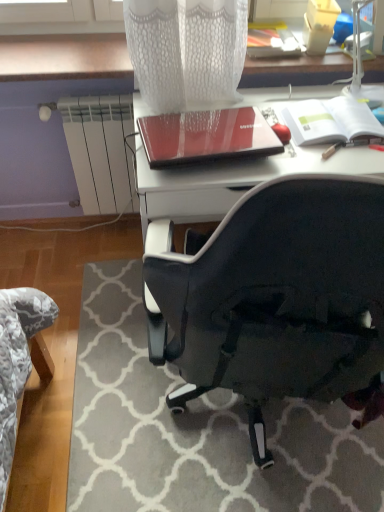
Measure the distance between white mesh table lamp at upper right and camera.

white mesh table lamp at upper right and camera are 1.47 meters apart from each other.

The width and height of the screenshot is (384, 512). Identify the location of black fabric chair at lower right. (277, 300).

Image resolution: width=384 pixels, height=512 pixels. What are the coordinates of `white mesh table lamp at upper right` in the screenshot? It's located at 361,62.

Is red glossy notebook at upper center, marked as the 1th notebook in a left-to-right arrangement, not close to black fabric chair at lower right?

Actually, red glossy notebook at upper center, marked as the 1th notebook in a left-to-right arrangement, and black fabric chair at lower right are a little close together.

Is red glossy notebook at upper center, which is the 2th notebook from right to left, looking in the opposite direction of black fabric chair at lower right?

No, red glossy notebook at upper center, which is the 2th notebook from right to left, is not facing the opposite direction of black fabric chair at lower right.

From a real-world perspective, is red glossy notebook at upper center, which is the 2th notebook from right to left, over black fabric chair at lower right?

Yes, from a real-world perspective, red glossy notebook at upper center, which is the 2th notebook from right to left, is on top of black fabric chair at lower right.

Considering the positions of objects red glossy notebook at upper center, marked as the 1th notebook in a left-to-right arrangement, and black fabric chair at lower right in the image provided, who is more to the right, red glossy notebook at upper center, marked as the 1th notebook in a left-to-right arrangement, or black fabric chair at lower right?

black fabric chair at lower right.

Which of these two, white matte notebook at upper right, the 1th notebook from the right, or white mesh table lamp at upper right, is wider?

With larger width is white matte notebook at upper right, the 1th notebook from the right.

Considering the relative sizes of white matte notebook at upper right, the 2th notebook in the left-to-right sequence, and white mesh table lamp at upper right in the image provided, is white matte notebook at upper right, the 2th notebook in the left-to-right sequence, bigger than white mesh table lamp at upper right?

No, white matte notebook at upper right, the 2th notebook in the left-to-right sequence, is not bigger than white mesh table lamp at upper right.

Could you tell me if white matte notebook at upper right, the 1th notebook from the right, is turned towards white mesh table lamp at upper right?

No, white matte notebook at upper right, the 1th notebook from the right, is not turned towards white mesh table lamp at upper right.

From the image's perspective, is white matte notebook at upper right, the 1th notebook from the right, located above or below white mesh table lamp at upper right?

Clearly, from the image's perspective, white matte notebook at upper right, the 1th notebook from the right, is below white mesh table lamp at upper right.

Which object is thinner, white mesh table lamp at upper right or white matte notebook at upper right, the 1th notebook from the right?

white mesh table lamp at upper right is thinner.

Can you see white mesh table lamp at upper right touching white matte notebook at upper right, the 2th notebook in the left-to-right sequence?

No, white mesh table lamp at upper right is not with white matte notebook at upper right, the 2th notebook in the left-to-right sequence.

How distant is white mesh table lamp at upper right from white matte notebook at upper right, the 2th notebook in the left-to-right sequence?

The distance of white mesh table lamp at upper right from white matte notebook at upper right, the 2th notebook in the left-to-right sequence, is 7.59 inches.

Between red glossy notebook at upper center, marked as the 1th notebook in a left-to-right arrangement, and white matte notebook at upper right, the 2th notebook in the left-to-right sequence, which one appears on the left side from the viewer's perspective?

red glossy notebook at upper center, marked as the 1th notebook in a left-to-right arrangement.

Measure the distance from red glossy notebook at upper center, marked as the 1th notebook in a left-to-right arrangement, to white matte notebook at upper right, the 2th notebook in the left-to-right sequence.

red glossy notebook at upper center, marked as the 1th notebook in a left-to-right arrangement, and white matte notebook at upper right, the 2th notebook in the left-to-right sequence, are 25.52 centimeters apart.

Which is closer, (242, 135) or (306, 123)?

Positioned in front is point (242, 135).

Between red glossy notebook at upper center, marked as the 1th notebook in a left-to-right arrangement, and white matte notebook at upper right, the 1th notebook from the right, which one has larger size?

With larger size is red glossy notebook at upper center, marked as the 1th notebook in a left-to-right arrangement.

From the image's perspective, is white matte notebook at upper right, the 2th notebook in the left-to-right sequence, above or below red glossy notebook at upper center, marked as the 1th notebook in a left-to-right arrangement?

Clearly, from the image's perspective, white matte notebook at upper right, the 2th notebook in the left-to-right sequence, is above red glossy notebook at upper center, marked as the 1th notebook in a left-to-right arrangement.

From the picture: Does white matte notebook at upper right, the 1th notebook from the right, have a greater width compared to red glossy notebook at upper center, marked as the 1th notebook in a left-to-right arrangement?

Incorrect, the width of white matte notebook at upper right, the 1th notebook from the right, does not surpass that of red glossy notebook at upper center, marked as the 1th notebook in a left-to-right arrangement.

Locate an element on the screen. notebook lying on the right of red glossy notebook at upper center, which is the 2th notebook from right to left is located at coordinates (330, 121).

Are white matte notebook at upper right, the 2th notebook in the left-to-right sequence, and red glossy notebook at upper center, marked as the 1th notebook in a left-to-right arrangement, beside each other?

white matte notebook at upper right, the 2th notebook in the left-to-right sequence, and red glossy notebook at upper center, marked as the 1th notebook in a left-to-right arrangement, are not in contact.

Based on the photo, could you tell me if white matte notebook at upper right, the 2th notebook in the left-to-right sequence, is turned towards black fabric chair at lower right?

No, white matte notebook at upper right, the 2th notebook in the left-to-right sequence, does not turn towards black fabric chair at lower right.

Which of these two, white matte notebook at upper right, the 1th notebook from the right, or black fabric chair at lower right, is wider?

Wider between the two is black fabric chair at lower right.

Can you confirm if white matte notebook at upper right, the 1th notebook from the right, is shorter than black fabric chair at lower right?

In fact, white matte notebook at upper right, the 1th notebook from the right, may be taller than black fabric chair at lower right.

Is white matte notebook at upper right, the 2th notebook in the left-to-right sequence, to the left of black fabric chair at lower right from the viewer's perspective?

No.

Is black fabric chair at lower right with red glossy notebook at upper center, which is the 2th notebook from right to left?

There is a gap between black fabric chair at lower right and red glossy notebook at upper center, which is the 2th notebook from right to left.

Considering the points (372, 274) and (242, 123), which point is behind, point (372, 274) or point (242, 123)?

The point (242, 123) is more distant.

Considering the sizes of black fabric chair at lower right and red glossy notebook at upper center, which is the 2th notebook from right to left, in the image, is black fabric chair at lower right taller or shorter than red glossy notebook at upper center, which is the 2th notebook from right to left,?

black fabric chair at lower right is shorter than red glossy notebook at upper center, which is the 2th notebook from right to left.

The height and width of the screenshot is (512, 384). Identify the location of notebook in front of the black fabric chair at lower right. (206, 136).

Find the location of a particular element. Image resolution: width=384 pixels, height=512 pixels. the 1st notebook counting from the left side of the white mesh table lamp at upper right is located at coordinates (330, 121).

Based on their spatial positions, is white mesh table lamp at upper right or white matte notebook at upper right, the 2th notebook in the left-to-right sequence, closer to red glossy notebook at upper center, marked as the 1th notebook in a left-to-right arrangement?

Among the two, white matte notebook at upper right, the 2th notebook in the left-to-right sequence, is located nearer to red glossy notebook at upper center, marked as the 1th notebook in a left-to-right arrangement.

Estimate the real-world distances between objects in this image. Which object is closer to red glossy notebook at upper center, which is the 2th notebook from right to left, black fabric chair at lower right or white mesh table lamp at upper right?

The object closer to red glossy notebook at upper center, which is the 2th notebook from right to left, is white mesh table lamp at upper right.

Which object lies nearer to the anchor point white matte notebook at upper right, the 2th notebook in the left-to-right sequence, white mesh table lamp at upper right or red glossy notebook at upper center, which is the 2th notebook from right to left?

white mesh table lamp at upper right lies closer to white matte notebook at upper right, the 2th notebook in the left-to-right sequence, than the other object.

Estimate the real-world distances between objects in this image. Which object is closer to white matte notebook at upper right, the 1th notebook from the right, red glossy notebook at upper center, marked as the 1th notebook in a left-to-right arrangement, or black fabric chair at lower right?

red glossy notebook at upper center, marked as the 1th notebook in a left-to-right arrangement.

Which object lies nearer to the anchor point red glossy notebook at upper center, which is the 2th notebook from right to left, white matte notebook at upper right, the 2th notebook in the left-to-right sequence, or black fabric chair at lower right?

white matte notebook at upper right, the 2th notebook in the left-to-right sequence, lies closer to red glossy notebook at upper center, which is the 2th notebook from right to left, than the other object.

When comparing their distances from black fabric chair at lower right, does white mesh table lamp at upper right or red glossy notebook at upper center, marked as the 1th notebook in a left-to-right arrangement, seem further?

white mesh table lamp at upper right.

When comparing their distances from red glossy notebook at upper center, which is the 2th notebook from right to left, does white mesh table lamp at upper right or black fabric chair at lower right seem further?

The object further to red glossy notebook at upper center, which is the 2th notebook from right to left, is black fabric chair at lower right.

When comparing their distances from white mesh table lamp at upper right, does white matte notebook at upper right, the 1th notebook from the right, or red glossy notebook at upper center, marked as the 1th notebook in a left-to-right arrangement, seem closer?

white matte notebook at upper right, the 1th notebook from the right, lies closer to white mesh table lamp at upper right than the other object.

Find the location of a particular element. notebook situated between red glossy notebook at upper center, which is the 2th notebook from right to left, and white mesh table lamp at upper right from left to right is located at coordinates (330, 121).

The height and width of the screenshot is (512, 384). In order to click on notebook between white matte notebook at upper right, the 2th notebook in the left-to-right sequence, and black fabric chair at lower right in the up-down direction in this screenshot , I will do `click(206, 136)`.